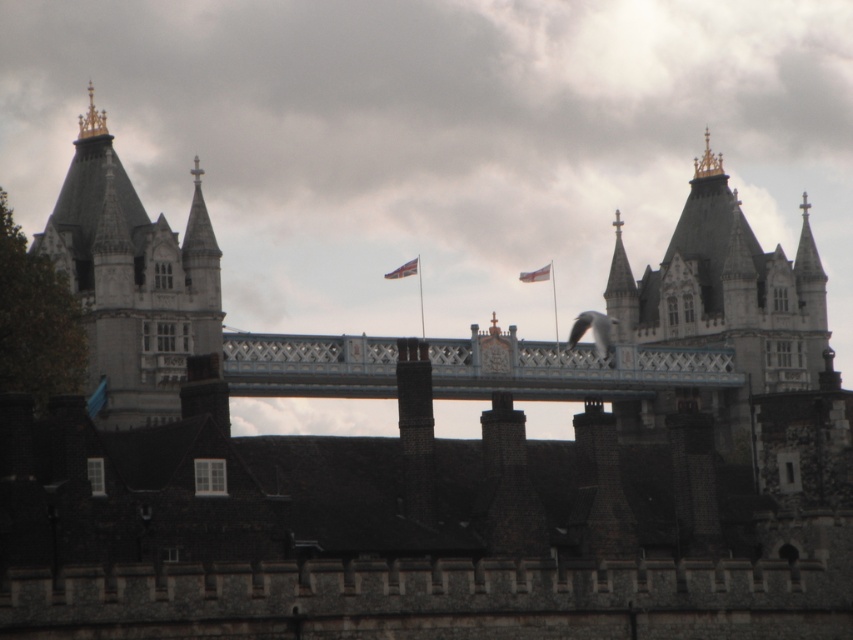
You are standing at the bridge with light blue metal railing and decorative patterns. There are two points marked on the structure. The first point is at coordinates point (189, 308) and the second is at point (579, 364). Which point is nearer to you?

Point (189, 308) is closer to the viewer than point (579, 364).